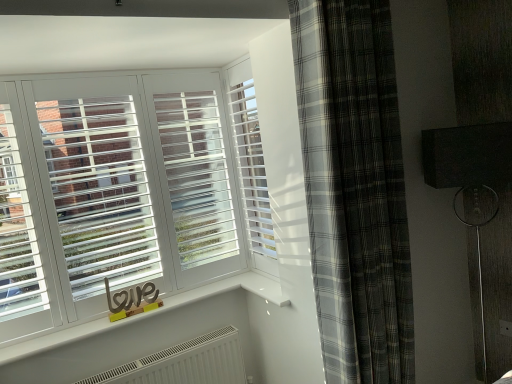
Question: From a real-world perspective, relative to gray plaid curtain at right, is white plastic blinds at center vertically above or below?

Choices:
 (A) below
 (B) above

Answer: (B)

Question: Considering the positions of white plastic blinds at center and gray plaid curtain at right in the image, is white plastic blinds at center bigger or smaller than gray plaid curtain at right?

Choices:
 (A) small
 (B) big

Answer: (A)

Question: Visually, is white plastic blinds at center positioned to the left or to the right of gray plaid curtain at right?

Choices:
 (A) left
 (B) right

Answer: (A)

Question: In terms of size, does gray plaid curtain at right appear bigger or smaller than white plastic blinds at center?

Choices:
 (A) big
 (B) small

Answer: (A)

Question: Considering the positions of gray plaid curtain at right and white plastic blinds at center in the image, is gray plaid curtain at right wider or thinner than white plastic blinds at center?

Choices:
 (A) thin
 (B) wide

Answer: (B)

Question: Relative to white plastic blinds at center, is gray plaid curtain at right in front or behind?

Choices:
 (A) front
 (B) behind

Answer: (A)

Question: In terms of height, does gray plaid curtain at right look taller or shorter compared to white plastic blinds at center?

Choices:
 (A) tall
 (B) short

Answer: (A)